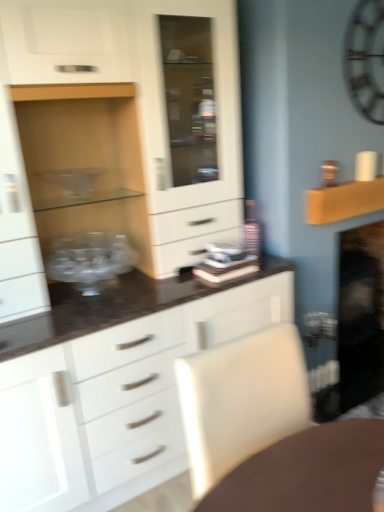
Question: Considering the relative positions of white leather swivel chair at lower right and wooden shelf at upper right in the image provided, is white leather swivel chair at lower right to the right of wooden shelf at upper right from the viewer's perspective?

Choices:
 (A) no
 (B) yes

Answer: (A)

Question: From the image's perspective, is white leather swivel chair at lower right located above wooden shelf at upper right?

Choices:
 (A) yes
 (B) no

Answer: (B)

Question: Is the depth of white leather swivel chair at lower right less than that of wooden shelf at upper right?

Choices:
 (A) no
 (B) yes

Answer: (B)

Question: Is white leather swivel chair at lower right completely or partially outside of wooden shelf at upper right?

Choices:
 (A) no
 (B) yes

Answer: (B)

Question: From a real-world perspective, is white leather swivel chair at lower right on wooden shelf at upper right?

Choices:
 (A) no
 (B) yes

Answer: (A)

Question: From the image's perspective, relative to white matte cabinet at center, is metallic silver clock at upper right above or below?

Choices:
 (A) below
 (B) above

Answer: (B)

Question: Is metallic silver clock at upper right spatially inside white matte cabinet at center, or outside of it?

Choices:
 (A) outside
 (B) inside

Answer: (A)

Question: From a real-world perspective, is metallic silver clock at upper right above or below white matte cabinet at center?

Choices:
 (A) below
 (B) above

Answer: (B)

Question: Considering their positions, is metallic silver clock at upper right located in front of or behind white matte cabinet at center?

Choices:
 (A) behind
 (B) front

Answer: (A)

Question: Is point (362, 189) positioned closer to the camera than point (64, 245)?

Choices:
 (A) farther
 (B) closer

Answer: (A)

Question: Would you say wooden shelf at upper right is to the left or to the right of transparent glass bowl at left in the picture?

Choices:
 (A) right
 (B) left

Answer: (A)

Question: Which is correct: wooden shelf at upper right is inside transparent glass bowl at left, or outside of it?

Choices:
 (A) outside
 (B) inside

Answer: (A)

Question: Looking at their shapes, would you say wooden shelf at upper right is wider or thinner than transparent glass bowl at left?

Choices:
 (A) thin
 (B) wide

Answer: (A)

Question: Would you say white matte cabinet at center is to the left or to the right of transparent glass bowl at left in the picture?

Choices:
 (A) right
 (B) left

Answer: (A)

Question: Considering their positions, is white matte cabinet at center located in front of or behind transparent glass bowl at left?

Choices:
 (A) behind
 (B) front

Answer: (B)